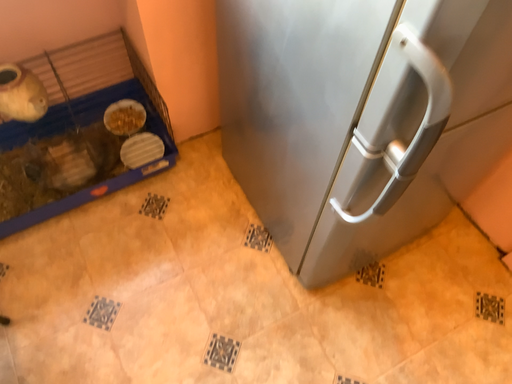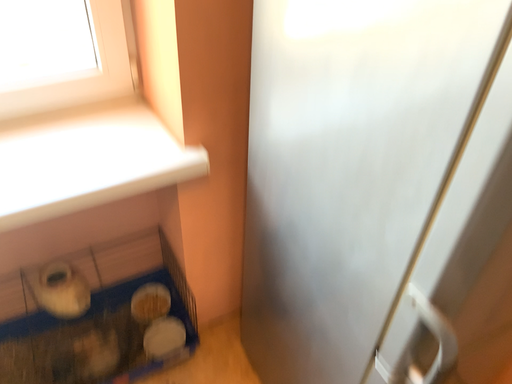
Question: How did the camera likely rotate when shooting the video?

Choices:
 (A) rotated upward
 (B) rotated downward

Answer: (A)